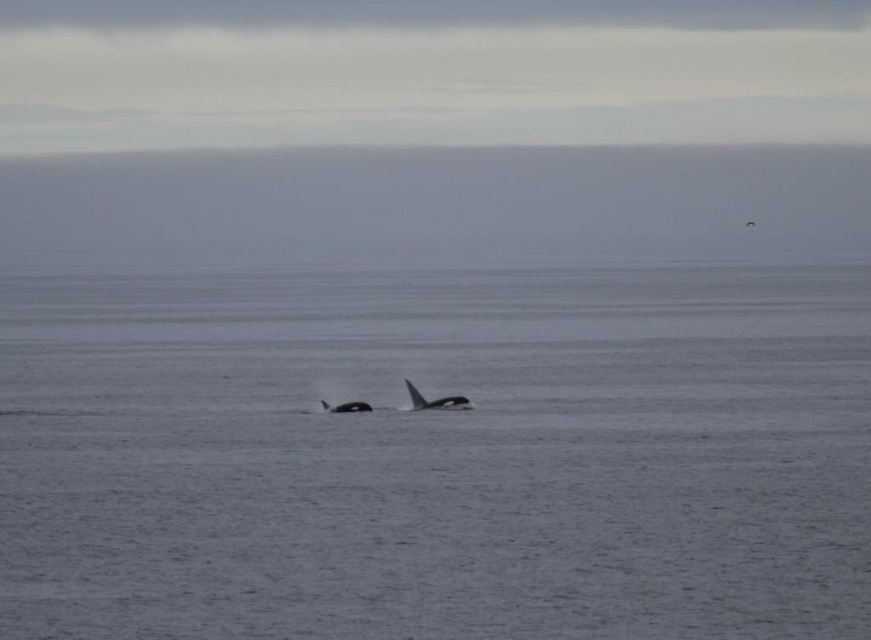
You are on a boat 100 feet away from the shore. You see the gray water at center. Can you safely swim to the shore without needing to dive underwater?

The gray water at center is 81.31 feet away from the camera. Since you are 100 feet away from the shore, the distance to the shore is greater than the distance to the gray water. Therefore, you can safely swim to the shore without needing to dive underwater.

You are a marine biologist studying orcas in the ocean. You notice a point at coordinates (437, 454) in the image. Based on the scene description, what does this point most likely represent?

The point at coordinates (437, 454) corresponds to the gray water at center, which is where the orcas are swimming.

You are a marine biologist observing the ocean scene. You notice the gray water at center. Can you determine its exact position in the image using coordinates?

The gray water at center is located at point (437, 454).